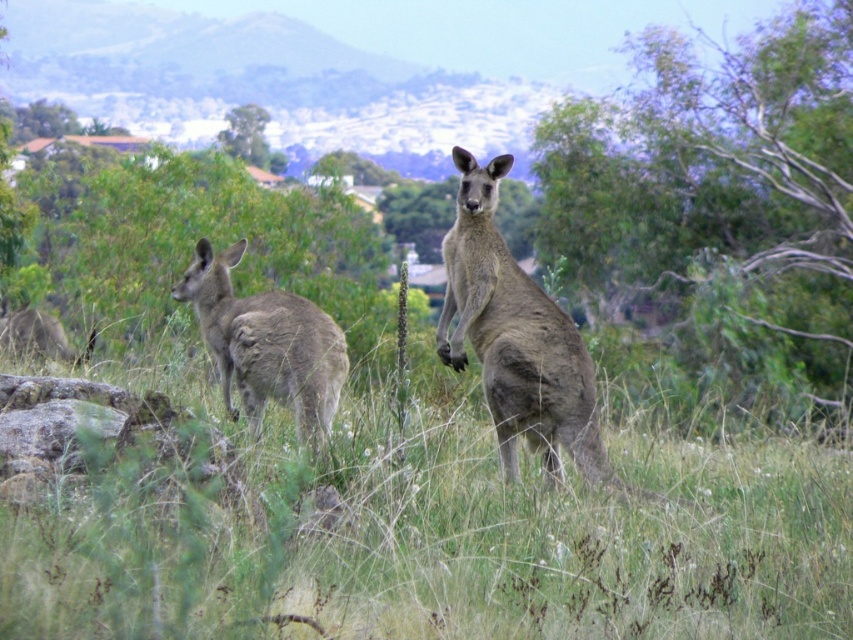
You are a photographer trying to capture a photo of the kangaroos in the scene. You notice two points marked in the image. The first point is at coordinate point [740,122] and the second is at point [274,168]. Based on their positions, which point is closer to the camera?

Point [740,122] is in front of point [274,168], so the first point is closer to the camera.

You are a photographer trying to capture a photo of both the gray fur kangaroo at center and the green leafy tree at upper center. Based on their positions, which object should you adjust your camera to focus on first to ensure both are in the frame?

The gray fur kangaroo at center is to the right of the green leafy tree at upper center. To ensure both are in the frame, you should focus on the green leafy tree at upper center first since it is positioned to the left of the kangaroo, allowing you to adjust the camera to include both from left to right.